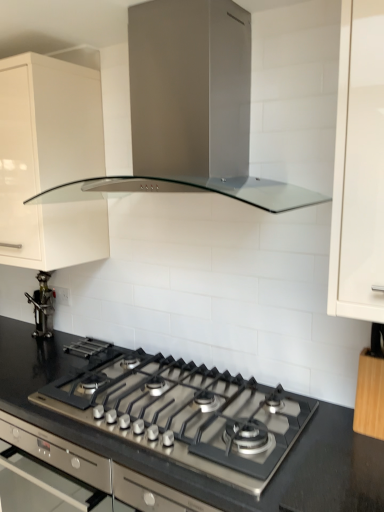
Identify the location of free spot below satin silver range hood at upper center (from a real-world perspective). This screenshot has height=512, width=384. (169, 383).